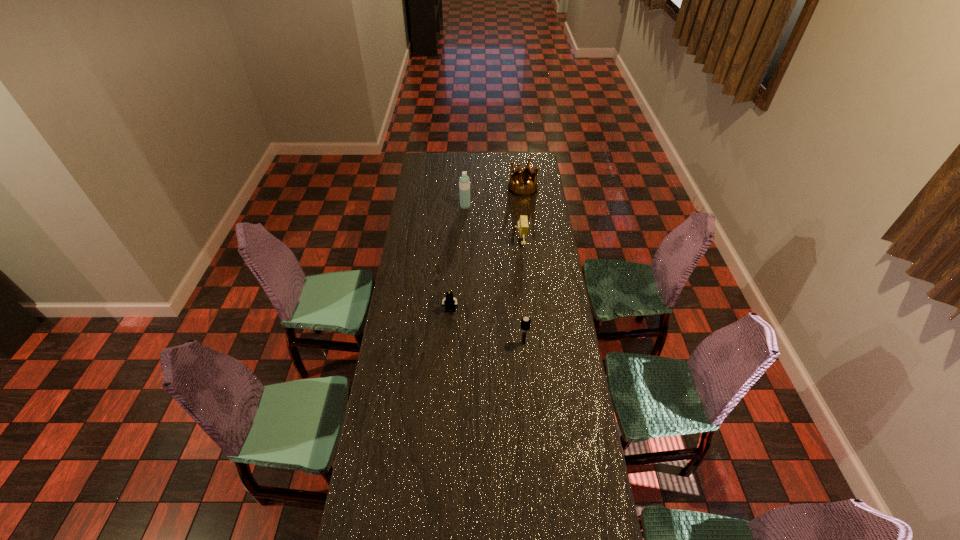
I want to click on free spot located 0.070m on the face of the sponge, so click(x=500, y=243).

Where is `vacant space situated 0.170m on the face of the sponge`? The width and height of the screenshot is (960, 540). vacant space situated 0.170m on the face of the sponge is located at coordinates (480, 243).

Find the location of a particular element. This screenshot has width=960, height=540. blank area located 0.390m on the face of the sponge is located at coordinates (438, 243).

The image size is (960, 540). What are the coordinates of `free space located on the front-facing side of the Lego` in the screenshot? It's located at (448, 351).

Identify the location of crown that is positioned at the right edge. (517, 188).

The image size is (960, 540). I want to click on sponge present at the right edge, so click(523, 226).

Where is `free space at the far edge of the desktop`? free space at the far edge of the desktop is located at coordinates (504, 165).

This screenshot has width=960, height=540. In the image, there is a desktop. Find the location of `free space at the left edge`. free space at the left edge is located at coordinates click(x=420, y=177).

The height and width of the screenshot is (540, 960). Identify the location of vacant space at the right edge of the desktop. (556, 384).

Identify the location of vacant region at the far left corner of the desktop. The image size is (960, 540). (436, 154).